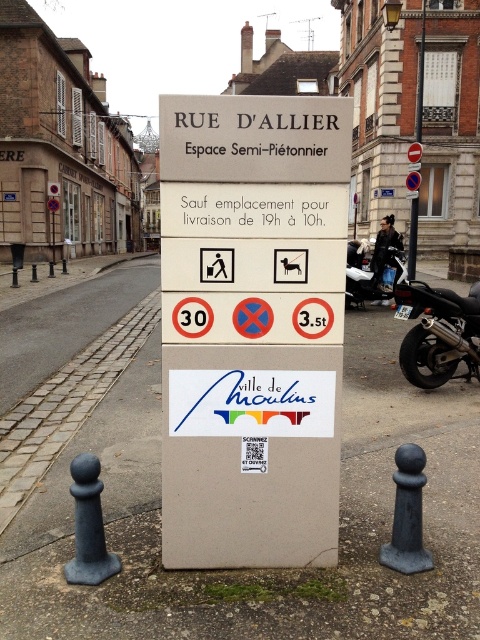
Is black metallic motorcycle at right bigger than black matte motorcycle at center?

No.

Does black metallic motorcycle at right have a lesser width compared to black matte motorcycle at center?

Yes.

Image resolution: width=480 pixels, height=640 pixels. I want to click on black metallic motorcycle at right, so click(437, 332).

From the picture: Between black matte motorcycle at center and metallic pole at center, which one is positioned lower?

Positioned lower is black matte motorcycle at center.

Which is more to the left, black matte motorcycle at center or metallic pole at center?

From the viewer's perspective, black matte motorcycle at center appears more on the left side.

The height and width of the screenshot is (640, 480). What do you see at coordinates (373, 280) in the screenshot? I see `black matte motorcycle at center` at bounding box center [373, 280].

You are a GUI agent. You are given a task and a screenshot of the screen. Output one action in this format:
    pyautogui.click(x=<x>, y=<y>)
    Task: Click on the black matte motorcycle at center
    The image size is (480, 640).
    Given the screenshot: What is the action you would take?
    pyautogui.click(x=373, y=280)

Can you confirm if beige plastic sign at center is positioned to the right of black metallic motorcycle at right?

Incorrect, beige plastic sign at center is not on the right side of black metallic motorcycle at right.

Is beige plastic sign at center in front of black metallic motorcycle at right?

Yes, beige plastic sign at center is closer to the viewer.

What do you see at coordinates (252, 326) in the screenshot? The height and width of the screenshot is (640, 480). I see `beige plastic sign at center` at bounding box center [252, 326].

You are a GUI agent. You are given a task and a screenshot of the screen. Output one action in this format:
    pyautogui.click(x=<x>, y=<y>)
    Task: Click on the beige plastic sign at center
    
    Given the screenshot: What is the action you would take?
    pyautogui.click(x=252, y=326)